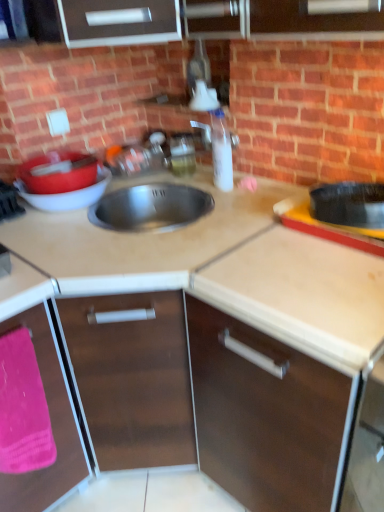
Question: Choose the correct answer: Is matte red basin at left inside brown matte cabinet at lower left, the 1th cabinetry when ordered from left to right, or outside it?

Choices:
 (A) inside
 (B) outside

Answer: (B)

Question: Is matte red basin at left bigger or smaller than brown matte cabinet at lower left, the 1th cabinetry when ordered from left to right?

Choices:
 (A) small
 (B) big

Answer: (A)

Question: Considering the real-world distances, which object is closest to the pink fabric at lower left?

Choices:
 (A) clear plastic bottle at center
 (B) translucent plastic soap dispenser at upper center
 (C) matte red basin at left
 (D) brown matte cabinet at center, arranged as the first cabinetry when viewed from the right
 (E) brown matte cabinet at lower left, the 2th cabinetry positioned from the right

Answer: (E)

Question: Which of these objects is positioned farthest from the beige laminate countertop at center, arranged as the second countertop when viewed from the top?

Choices:
 (A) pink fabric at lower left
 (B) translucent plastic soap dispenser at upper center
 (C) clear plastic bottle at center
 (D) satin steel sink at center, which is the 2th countertop from bottom to top
 (E) matte red basin at left

Answer: (B)